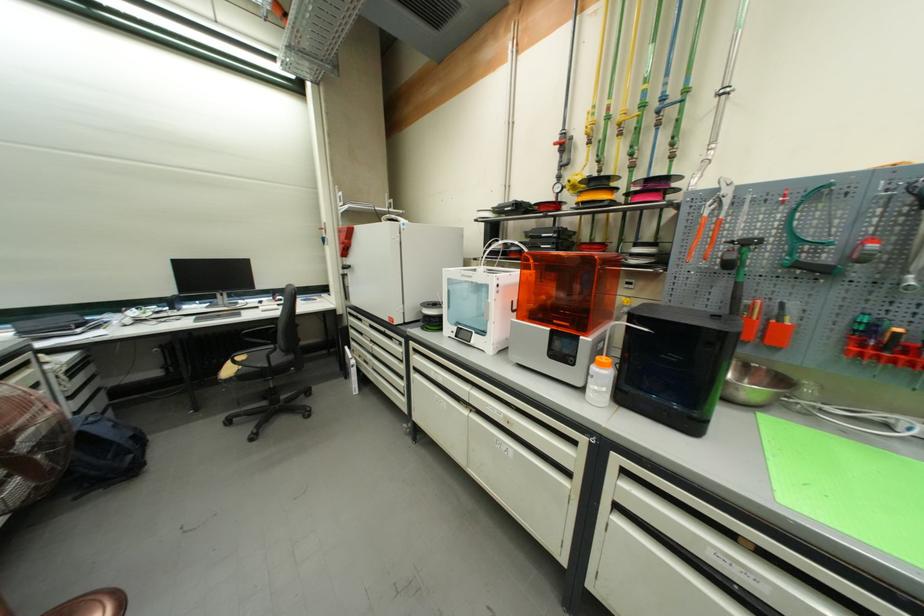
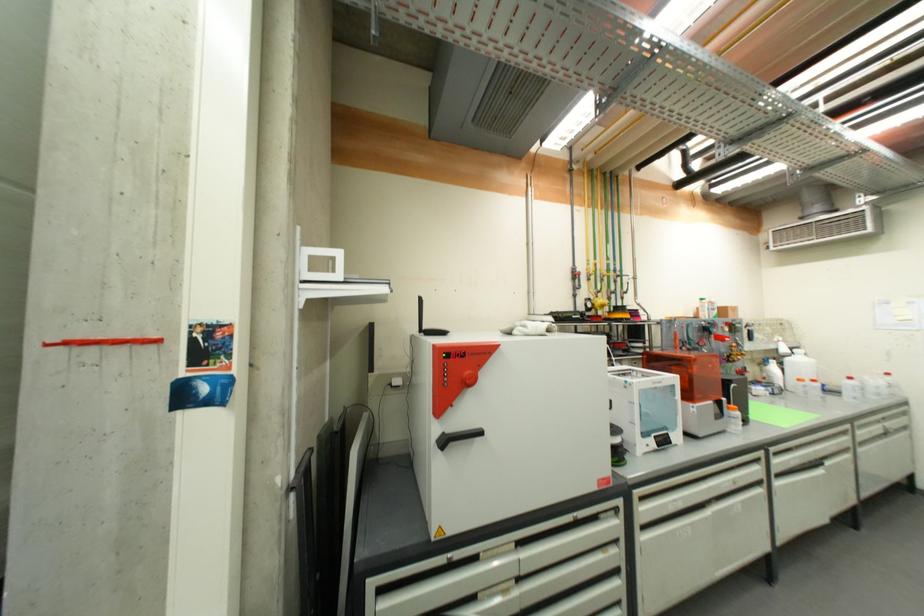
Where in the second image is the point corresponding to point (606, 367) from the first image?

(739, 411)